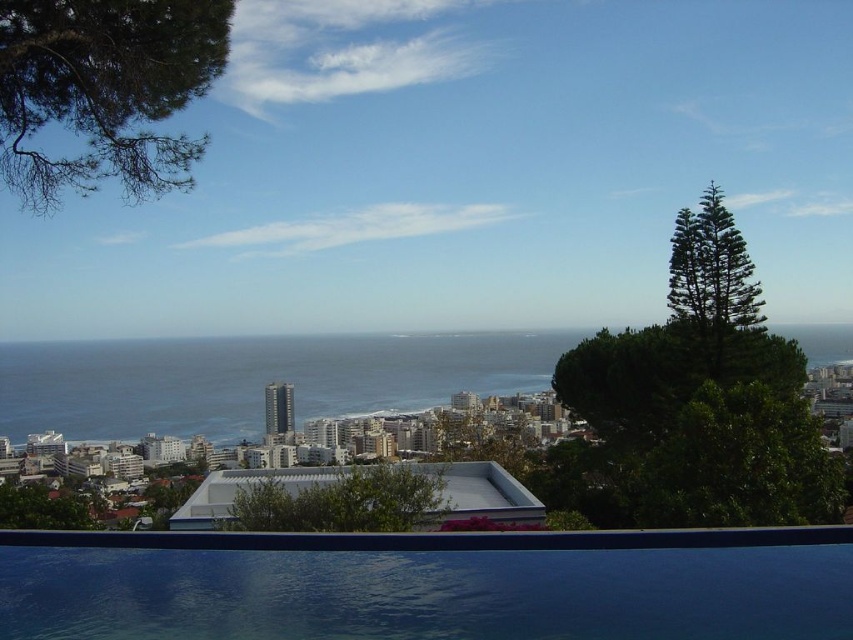
Question: Which point is farther to the camera?

Choices:
 (A) blue water at center
 (B) dark blue smooth pool at lower center

Answer: (A)

Question: Can you confirm if dark blue smooth pool at lower center is positioned above blue water at center?

Choices:
 (A) yes
 (B) no

Answer: (B)

Question: Does dark blue smooth pool at lower center appear on the left side of blue water at center?

Choices:
 (A) no
 (B) yes

Answer: (A)

Question: Is dark blue smooth pool at lower center thinner than blue water at center?

Choices:
 (A) yes
 (B) no

Answer: (A)

Question: Which object is farther from the camera taking this photo?

Choices:
 (A) dark blue smooth pool at lower center
 (B) blue water at center

Answer: (B)